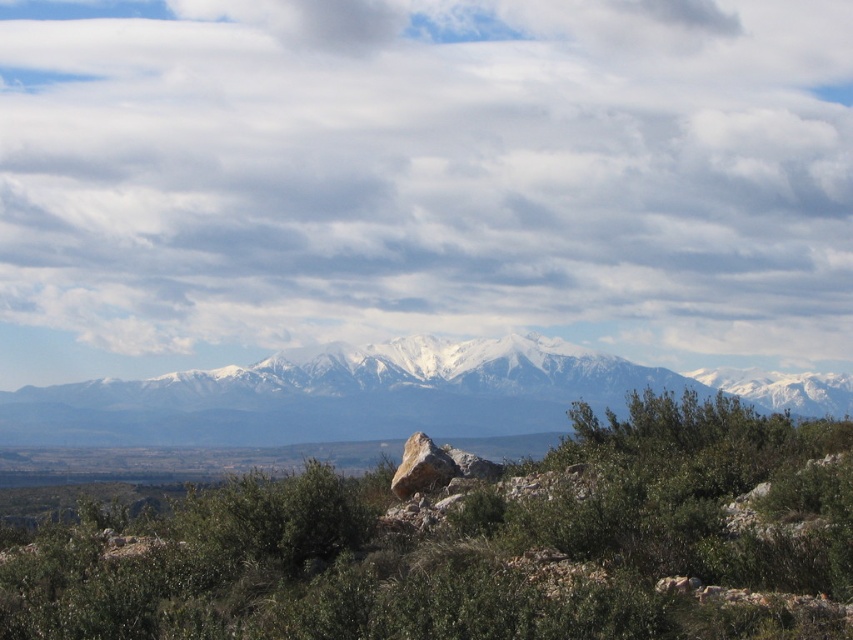
Is green leafy shrubs at center further to camera compared to smooth gray rock at center?

No, green leafy shrubs at center is in front of smooth gray rock at center.

Who is more distant from viewer, (653,422) or (442,468)?

Point (653,422)

Identify the location of green leafy shrubs at center. (477, 545).

Consider the image. Which is below, cloudy sky at upper center or smooth gray rock at center?

Positioned lower is smooth gray rock at center.

Can you confirm if cloudy sky at upper center is smaller than smooth gray rock at center?

Incorrect, cloudy sky at upper center is not smaller in size than smooth gray rock at center.

This screenshot has width=853, height=640. Identify the location of cloudy sky at upper center. (422, 179).

Is cloudy sky at upper center thinner than green leafy shrubs at center?

No.

This screenshot has height=640, width=853. I want to click on cloudy sky at upper center, so click(x=422, y=179).

This screenshot has width=853, height=640. Find the location of `cloudy sky at upper center`. cloudy sky at upper center is located at coordinates (422, 179).